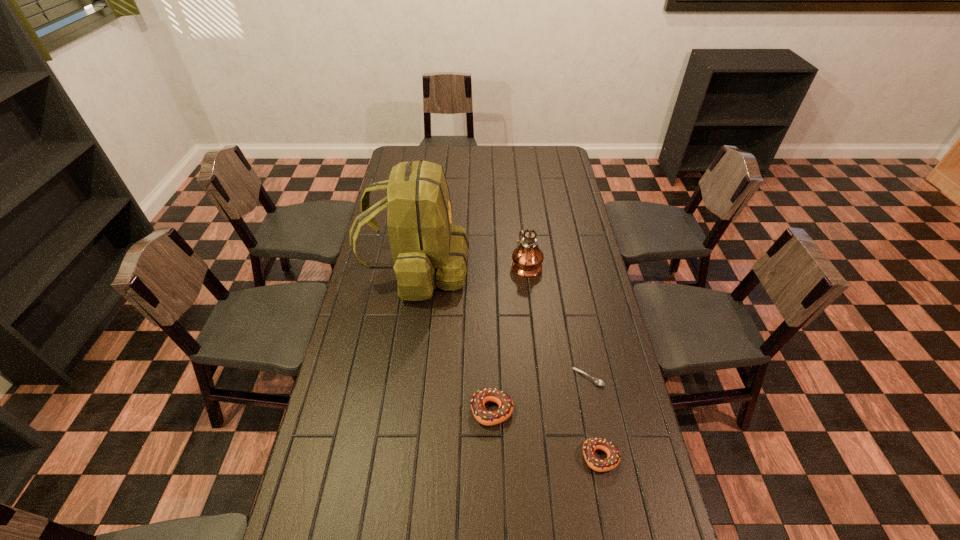
Find the location of a particular element. The image size is (960, 540). vacant space positioned 0.180m on the front of the fourth farthest object is located at coordinates (493, 495).

Identify the location of vacant space located 0.290m on the back of the nearest object. This screenshot has height=540, width=960. (581, 354).

The image size is (960, 540). Identify the location of vacant space situated on the left of the oil lamp. (412, 264).

Locate an element on the screen. This screenshot has width=960, height=540. free point located on the front-facing side of the leftmost object is located at coordinates (507, 268).

In order to click on vacant area situated 0.220m on the back of the third nearest object in this screenshot , I will do click(575, 314).

You are a GUI agent. You are given a task and a screenshot of the screen. Output one action in this format:
    pyautogui.click(x=<x>, y=<y>)
    Task: Click on the object that is at the left edge
    The height and width of the screenshot is (540, 960).
    Given the screenshot: What is the action you would take?
    pyautogui.click(x=428, y=250)

Identify the location of doughnut situated at the right edge. (590, 445).

Find the location of a particular element. The height and width of the screenshot is (540, 960). soupspoon at the right edge is located at coordinates (597, 381).

In the image, there is a desktop. Identify the location of vacant space at the far edge. (516, 159).

This screenshot has width=960, height=540. What are the coordinates of `vacant space at the near edge of the desktop` in the screenshot? It's located at (577, 507).